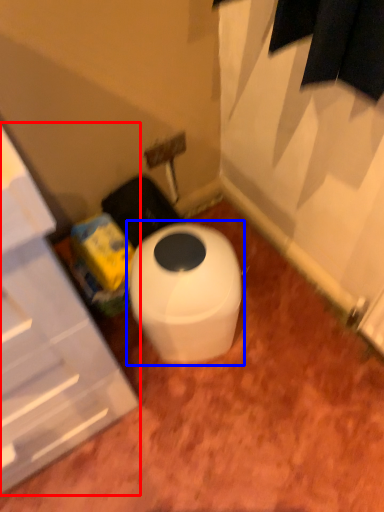
Question: Which object is further to the camera taking this photo, cabinetry (highlighted by a red box) or toilet (highlighted by a blue box)?

Choices:
 (A) cabinetry
 (B) toilet

Answer: (B)